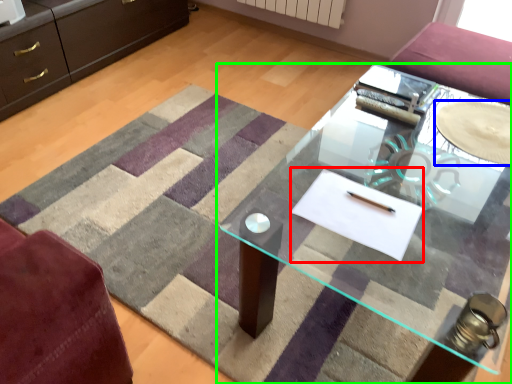
Question: Which is farther away from flat (highlighted by a red box)? glass plate (highlighted by a blue box) or table (highlighted by a green box)?

Choices:
 (A) glass plate
 (B) table

Answer: (B)